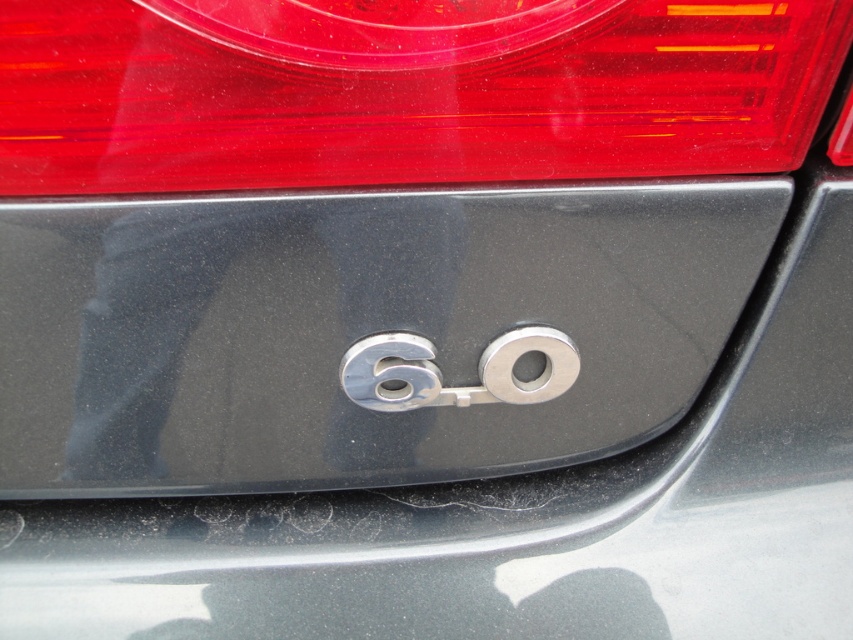
Is metallic gray emblem at center below transparent plastic brake light at upper center?

Yes, metallic gray emblem at center is below transparent plastic brake light at upper center.

Between metallic gray emblem at center and transparent plastic brake light at upper center, which one appears on the right side from the viewer's perspective?

transparent plastic brake light at upper center

Is point (338, 209) farther from camera compared to point (213, 180)?

Yes, point (338, 209) is farther from viewer.

Find the location of `metallic gray emblem at center`. metallic gray emblem at center is located at coordinates (360, 332).

Does transparent plastic brake light at upper center have a lesser width compared to chrome metallic number at center?

Incorrect, transparent plastic brake light at upper center's width is not less than chrome metallic number at center's.

Does transparent plastic brake light at upper center appear on the right side of chrome metallic number at center?

No, transparent plastic brake light at upper center is not to the right of chrome metallic number at center.

The width and height of the screenshot is (853, 640). What do you see at coordinates (405, 92) in the screenshot?
I see `transparent plastic brake light at upper center` at bounding box center [405, 92].

You are a GUI agent. You are given a task and a screenshot of the screen. Output one action in this format:
    pyautogui.click(x=<x>, y=<y>)
    Task: Click on the transparent plastic brake light at upper center
    The width and height of the screenshot is (853, 640).
    Given the screenshot: What is the action you would take?
    pyautogui.click(x=405, y=92)

Is metallic gray emblem at center above chrome metallic number at center?

Correct, metallic gray emblem at center is located above chrome metallic number at center.

Does point (432, 372) come behind point (567, 372)?

No, it is in front of (567, 372).

Where is `metallic gray emblem at center`? This screenshot has width=853, height=640. metallic gray emblem at center is located at coordinates (360, 332).